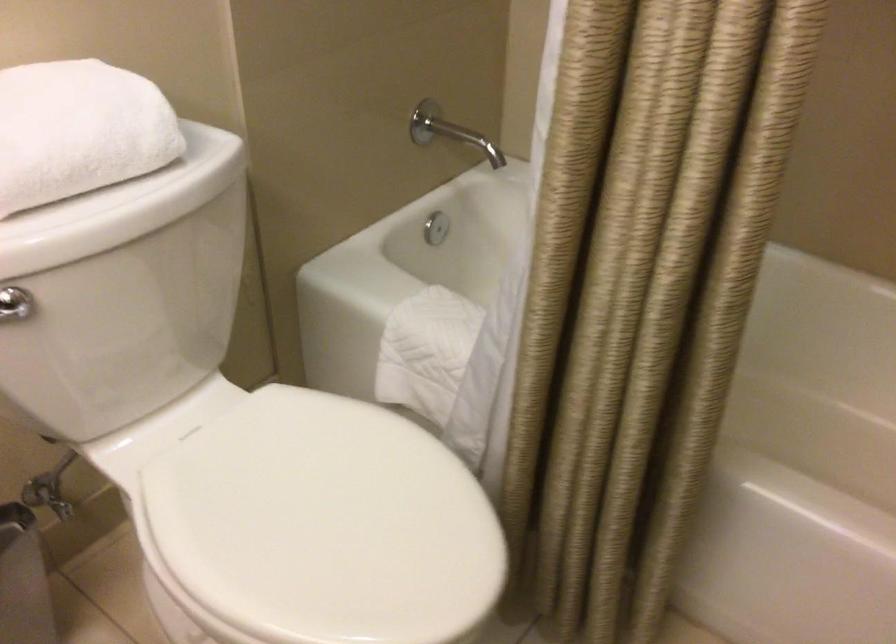
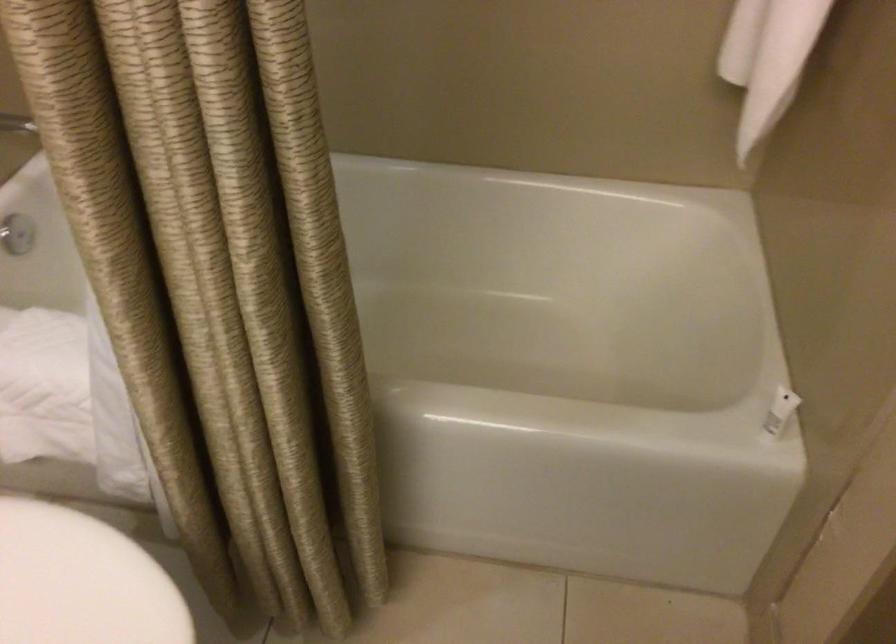
Question: The first image is from the beginning of the video and the second image is from the end. How did the camera likely rotate when shooting the video?

Choices:
 (A) Left
 (B) Right
 (C) Up
 (D) Down

Answer: (B)